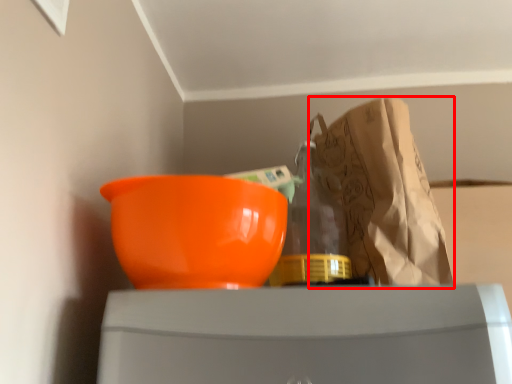
Question: From the image's perspective, what is the correct spatial positioning of grocery bag (annotated by the red box) in reference to bowl?

Choices:
 (A) below
 (B) above

Answer: (B)